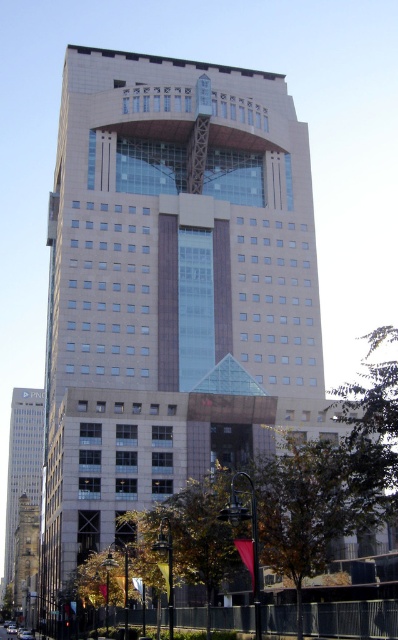
Who is more forward, (25, 484) or (23, 628)?

Point (23, 628)

Which is in front, point (39, 412) or point (25, 632)?

Point (25, 632)

The width and height of the screenshot is (398, 640). Find the location of `matte glass tower at left`. matte glass tower at left is located at coordinates (23, 461).

Can you confirm if matte glass tower at left is thinner than silver metallic car at center?

In fact, matte glass tower at left might be wider than silver metallic car at center.

Who is positioned more to the left, matte glass tower at left or silver metallic car at center?

From the viewer's perspective, matte glass tower at left appears more on the left side.

Between point (31, 488) and point (7, 630), which one is positioned in front?

Point (7, 630)

Locate an element on the screen. Image resolution: width=398 pixels, height=640 pixels. matte glass tower at left is located at coordinates point(23,461).

How far apart are matte glass tower at left and stone tower at left?

matte glass tower at left and stone tower at left are 73.84 feet apart from each other.

Can you confirm if matte glass tower at left is taller than stone tower at left?

Yes, matte glass tower at left is taller than stone tower at left.

Measure the distance between matte glass tower at left and camera.

615.81 feet

Identify the location of matte glass tower at left. (23, 461).